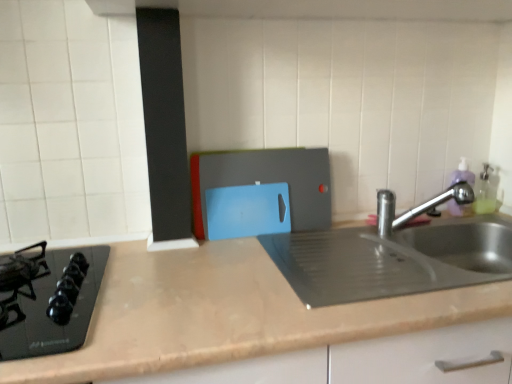
The width and height of the screenshot is (512, 384). In order to click on blue plastic cutting board at center in this screenshot , I will do `click(260, 192)`.

Describe the element at coordinates (416, 206) in the screenshot. I see `satin nickel faucet at right` at that location.

The height and width of the screenshot is (384, 512). Identify the location of blue plastic cutting board at center. (260, 192).

Looking at this image, relative to blue plastic cutting board at center, is satin nickel faucet at right in front or behind?

In the image, satin nickel faucet at right appears in front of blue plastic cutting board at center.

Considering the relative sizes of satin nickel faucet at right and blue plastic cutting board at center in the image provided, is satin nickel faucet at right wider than blue plastic cutting board at center?

Correct, the width of satin nickel faucet at right exceeds that of blue plastic cutting board at center.

In the image, is satin nickel faucet at right on the left side or the right side of blue plastic cutting board at center?

satin nickel faucet at right is to the right of blue plastic cutting board at center.

Does satin nickel faucet at right have a greater height compared to blue plastic cutting board at center?

In fact, satin nickel faucet at right may be shorter than blue plastic cutting board at center.

Is black glass gas stove at left thinner than blue plastic cutting board at center?

Incorrect, the width of black glass gas stove at left is not less than that of blue plastic cutting board at center.

Considering the sizes of objects black glass gas stove at left and blue plastic cutting board at center in the image provided, who is taller, black glass gas stove at left or blue plastic cutting board at center?

With more height is blue plastic cutting board at center.

How distant is black glass gas stove at left from blue plastic cutting board at center?

black glass gas stove at left is 46.36 centimeters away from blue plastic cutting board at center.

Is black glass gas stove at left at the left side of blue plastic cutting board at center?

Yes.

Does point (70, 311) come farther from viewer compared to point (386, 199)?

No, (70, 311) is in front of (386, 199).

Is black glass gas stove at left far from satin nickel faucet at right?

No, black glass gas stove at left is not far away from satin nickel faucet at right.

Consider the image. From a real-world perspective, is black glass gas stove at left physically located above or below satin nickel faucet at right?

Clearly, from a real-world perspective, black glass gas stove at left is below satin nickel faucet at right.

From the image's perspective, is black glass gas stove at left above satin nickel faucet at right?

No, from the image's perspective, black glass gas stove at left is not above satin nickel faucet at right.

Can you confirm if blue plastic cutting board at center is shorter than satin nickel faucet at right?

Incorrect, the height of blue plastic cutting board at center does not fall short of that of satin nickel faucet at right.

Relative to satin nickel faucet at right, is blue plastic cutting board at center in front or behind?

Visually, blue plastic cutting board at center is located behind satin nickel faucet at right.

Between point (324, 212) and point (456, 199), which one is positioned behind?

The point (456, 199) is farther.

Is satin nickel faucet at right with black glass gas stove at left?

They are not placed beside each other.

Is satin nickel faucet at right bigger or smaller than black glass gas stove at left?

Clearly, satin nickel faucet at right is smaller in size than black glass gas stove at left.

Looking at this image, in the image, is satin nickel faucet at right on the left side or the right side of black glass gas stove at left?

From the image, it's evident that satin nickel faucet at right is to the right of black glass gas stove at left.

Does satin nickel faucet at right have a lesser width compared to black glass gas stove at left?

Correct, the width of satin nickel faucet at right is less than that of black glass gas stove at left.

Between blue plastic cutting board at center and black glass gas stove at left, which one appears on the right side from the viewer's perspective?

Positioned to the right is blue plastic cutting board at center.

Is the depth of blue plastic cutting board at center less than that of black glass gas stove at left?

No, blue plastic cutting board at center is further to the viewer.

From a real-world perspective, is blue plastic cutting board at center positioned under black glass gas stove at left based on gravity?

No.

How different are the orientations of blue plastic cutting board at center and black glass gas stove at left in degrees?

The angular difference between blue plastic cutting board at center and black glass gas stove at left is 0.38 degrees.

Identify the location of appliance on the left of satin nickel faucet at right. The image size is (512, 384). (260, 192).

Where is `gas stove located in front of the blue plastic cutting board at center`? gas stove located in front of the blue plastic cutting board at center is located at coordinates (48, 299).

From the image, which object appears to be nearer to satin nickel faucet at right, black glass gas stove at left or blue plastic cutting board at center?

blue plastic cutting board at center is closer to satin nickel faucet at right.

Considering their positions, is satin nickel faucet at right positioned further to blue plastic cutting board at center than black glass gas stove at left?

black glass gas stove at left is positioned further to the anchor blue plastic cutting board at center.

Considering their positions, is blue plastic cutting board at center positioned closer to black glass gas stove at left than satin nickel faucet at right?

blue plastic cutting board at center.

Considering their positions, is satin nickel faucet at right positioned further to black glass gas stove at left than blue plastic cutting board at center?

Among the two, satin nickel faucet at right is located further to black glass gas stove at left.

Which object lies nearer to the anchor point satin nickel faucet at right, blue plastic cutting board at center or black glass gas stove at left?

The object closer to satin nickel faucet at right is blue plastic cutting board at center.

From the image, which object appears to be farther from blue plastic cutting board at center, black glass gas stove at left or satin nickel faucet at right?

black glass gas stove at left lies further to blue plastic cutting board at center than the other object.

Identify the location of appliance located between black glass gas stove at left and satin nickel faucet at right in the left-right direction. (260, 192).